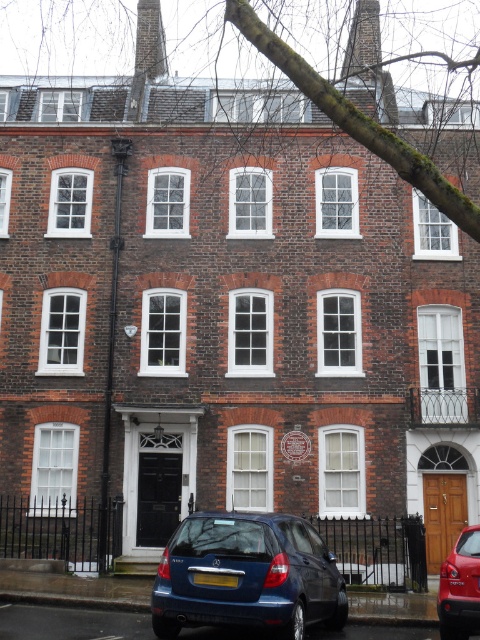
You are a delivery person approaching the building and see the glossy metallic hatchback at lower center and the metallic blue hatchback at center. Which car should you park to the right side of the other?

You should park the metallic blue hatchback at center to the right side of the glossy metallic hatchback at lower center because the glossy metallic hatchback at lower center is already positioned to the left of the metallic blue hatchback at center.